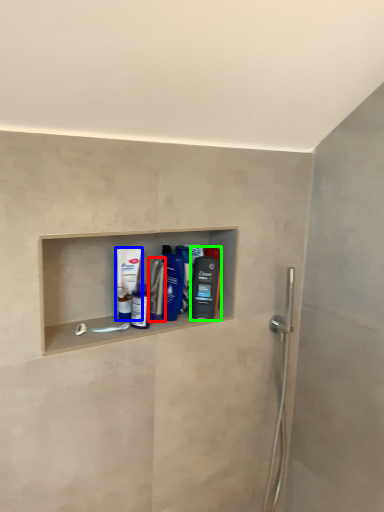
Question: Based on their relative distances, which object is nearer to mouthwash (highlighted by a red box)? Choose from mouthwash (highlighted by a blue box) and mouthwash (highlighted by a green box).

Choices:
 (A) mouthwash
 (B) mouthwash

Answer: (A)